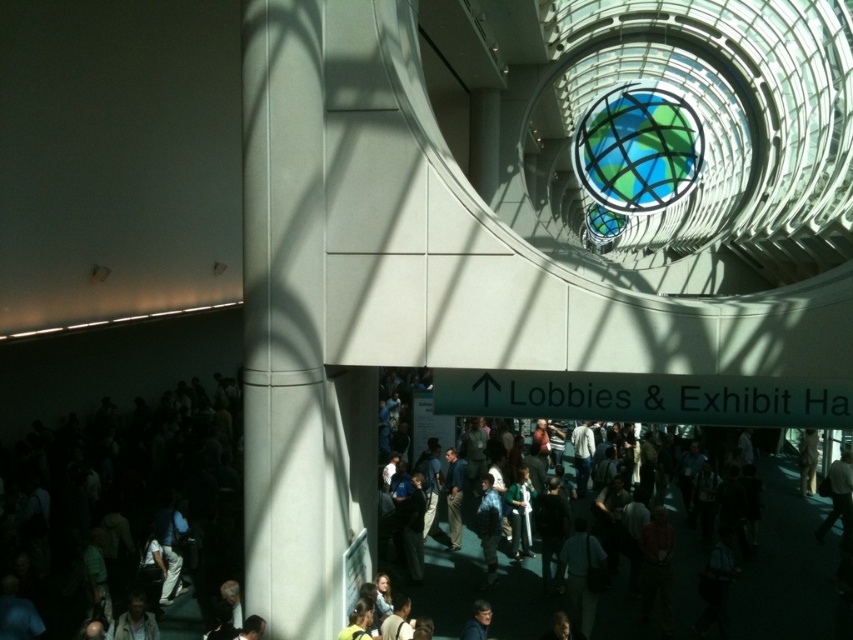
You are an event planner standing at the entrance of the convention center and see the white smooth pillar at left and the dark gray textured jacket at center. Which object is closer to you?

The white smooth pillar at left is closer to you because it is in front of the dark gray textured jacket at center.

You are an event planner standing at the entrance of the convention center and see the dark gray suit at lower left and the white smooth pillar at left. Which object is closer to the entrance?

The dark gray suit at lower left is closer to the entrance because it is positioned under the white smooth pillar at left, meaning it is located in front of the pillar and thus nearer to the entrance.